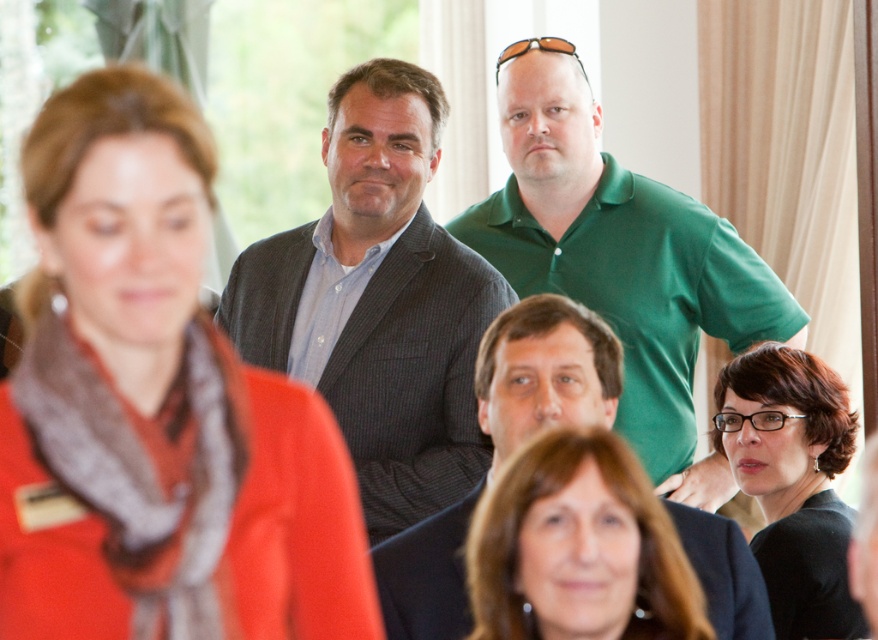
Does point (430, 426) come behind point (486, 346)?

Yes.

Who is positioned more to the left, matte gray blazer at center or matte gray suit at center?

Positioned to the left is matte gray blazer at center.

Image resolution: width=878 pixels, height=640 pixels. Identify the location of matte gray blazer at center. (x=378, y=301).

What are the coordinates of `matte gray blazer at center` in the screenshot? It's located at (378, 301).

Looking at this image, between matte gray blazer at center and matte brown hair at center, which one appears on the left side from the viewer's perspective?

Positioned to the left is matte gray blazer at center.

Consider the image. Does matte gray blazer at center come in front of matte brown hair at center?

No, it is not.

The image size is (878, 640). I want to click on matte gray blazer at center, so click(x=378, y=301).

Who is higher up, matte red scarf at center or matte gray suit at center?

matte red scarf at center

Based on the photo, does matte red scarf at center have a greater width compared to matte gray suit at center?

No.

You are a GUI agent. You are given a task and a screenshot of the screen. Output one action in this format:
    pyautogui.click(x=<x>, y=<y>)
    Task: Click on the matte red scarf at center
    The height and width of the screenshot is (640, 878).
    Given the screenshot: What is the action you would take?
    pyautogui.click(x=156, y=406)

Locate an element on the screen. The image size is (878, 640). matte red scarf at center is located at coordinates (156, 406).